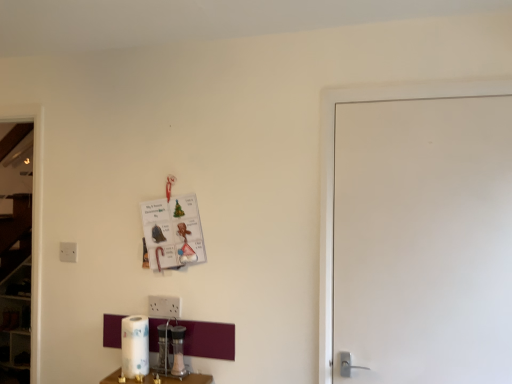
Question: From a real-world perspective, is white matte door at right physically above metallic silver salt shaker at lower center?

Choices:
 (A) no
 (B) yes

Answer: (B)

Question: Is white matte door at right positioned far away from metallic silver salt shaker at lower center?

Choices:
 (A) no
 (B) yes

Answer: (A)

Question: Is white matte door at right further to the viewer compared to metallic silver salt shaker at lower center?

Choices:
 (A) yes
 (B) no

Answer: (B)

Question: Is white matte door at right oriented towards metallic silver salt shaker at lower center?

Choices:
 (A) no
 (B) yes

Answer: (A)

Question: Is white matte door at right in contact with metallic silver salt shaker at lower center?

Choices:
 (A) no
 (B) yes

Answer: (A)

Question: In the image, is metallic silver salt shaker at lower center on the left side or the right side of white plastic electric outlet at left?

Choices:
 (A) right
 (B) left

Answer: (A)

Question: From the image's perspective, is metallic silver salt shaker at lower center above or below white plastic electric outlet at left?

Choices:
 (A) above
 (B) below

Answer: (B)

Question: Choose the correct answer: Is metallic silver salt shaker at lower center inside white plastic electric outlet at left or outside it?

Choices:
 (A) outside
 (B) inside

Answer: (A)

Question: Is metallic silver salt shaker at lower center taller or shorter than white plastic electric outlet at left?

Choices:
 (A) short
 (B) tall

Answer: (A)

Question: Based on their sizes in the image, would you say white matte door at right is bigger or smaller than white plastic electric outlet at left?

Choices:
 (A) big
 (B) small

Answer: (A)

Question: Visually, is white matte door at right positioned to the left or to the right of white plastic electric outlet at left?

Choices:
 (A) left
 (B) right

Answer: (B)

Question: Does point (467, 241) appear closer or farther from the camera than point (60, 258)?

Choices:
 (A) closer
 (B) farther

Answer: (A)

Question: Is white matte door at right taller or shorter than white plastic electric outlet at left?

Choices:
 (A) tall
 (B) short

Answer: (A)

Question: Considering the positions of white glossy paper towel at lower center and white plastic electric outlet at left in the image, is white glossy paper towel at lower center bigger or smaller than white plastic electric outlet at left?

Choices:
 (A) small
 (B) big

Answer: (B)

Question: In the image, is white glossy paper towel at lower center on the left side or the right side of white plastic electric outlet at left?

Choices:
 (A) right
 (B) left

Answer: (A)